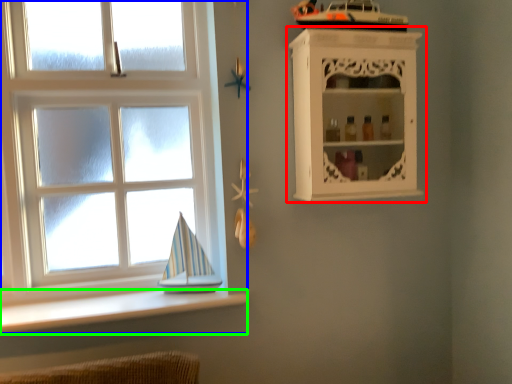
Question: Which object is positioned farthest from shelf (highlighted by a red box)? Select from window (highlighted by a blue box) and ledge (highlighted by a green box).

Choices:
 (A) window
 (B) ledge

Answer: (B)